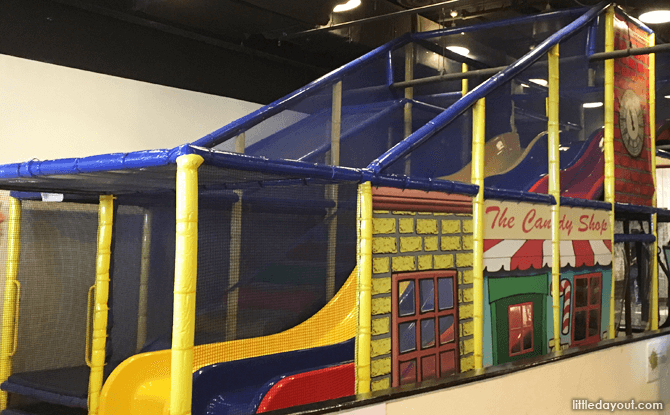
Where is `kid's activity center`? This screenshot has width=670, height=415. kid's activity center is located at coordinates (342, 205).